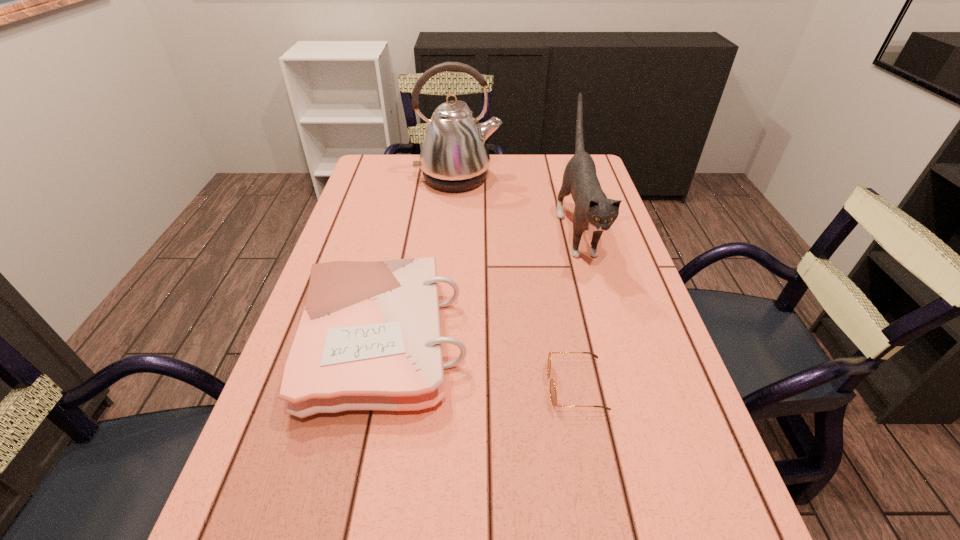
Find the location of a particular element. The image size is (960, 540). kettle is located at coordinates (454, 157).

Where is `the second tallest object`? the second tallest object is located at coordinates (593, 211).

This screenshot has height=540, width=960. What are the coordinates of `phonebook` in the screenshot? It's located at (369, 338).

I want to click on sunglasses, so click(x=553, y=394).

You are a GUI agent. You are given a task and a screenshot of the screen. Output one action in this format:
    pyautogui.click(x=<x>, y=<y>)
    Task: Click on the vacant space located on the left of the tallest object
    This screenshot has width=960, height=540.
    Given the screenshot: What is the action you would take?
    pyautogui.click(x=374, y=178)

This screenshot has height=540, width=960. Identify the location of vacant space located at the face of the cat. (610, 344).

Find the location of a particular element. The width and height of the screenshot is (960, 540). vacant space located 0.130m on the right of the second shortest object is located at coordinates (529, 341).

Identify the location of free space located 0.260m on the lenses of the shortest object. The height and width of the screenshot is (540, 960). (413, 386).

You are a GUI agent. You are given a task and a screenshot of the screen. Output one action in this format:
    pyautogui.click(x=<x>, y=<y>)
    Task: Click on the vacant space located 0.300m on the lenses of the shortest object
    Image resolution: width=960 pixels, height=540 pixels.
    Given the screenshot: What is the action you would take?
    pyautogui.click(x=392, y=386)

At what (x,y) coordinates should I click in order to perform the action: click on vacant point located on the lenses of the shortest object. Please return your answer as a coordinate pair (x, y). Looking at the image, I should click on (407, 386).